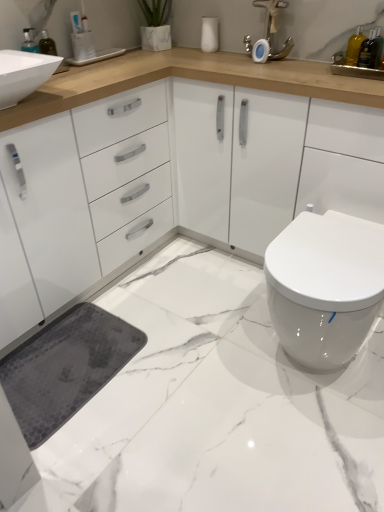
Question: Is blue plastic toothbrush at upper left, the first toiletry from the top, not inside matte silver faucet at upper center?

Choices:
 (A) yes
 (B) no

Answer: (A)

Question: Is blue plastic toothbrush at upper left, the 1th toiletry from the left, thinner than matte silver faucet at upper center?

Choices:
 (A) no
 (B) yes

Answer: (B)

Question: From the image's perspective, does blue plastic toothbrush at upper left, placed as the 1th toiletry when sorted from back to front, appear lower than matte silver faucet at upper center?

Choices:
 (A) yes
 (B) no

Answer: (A)

Question: From a real-world perspective, does blue plastic toothbrush at upper left, positioned as the 2th toiletry in bottom-to-top order, stand above matte silver faucet at upper center?

Choices:
 (A) no
 (B) yes

Answer: (B)

Question: Is blue plastic toothbrush at upper left, the 1th toiletry from the left, far from matte silver faucet at upper center?

Choices:
 (A) yes
 (B) no

Answer: (B)

Question: From the image's perspective, is blue plastic toothbrush at upper left, the first toiletry from the top, on top of matte silver faucet at upper center?

Choices:
 (A) no
 (B) yes

Answer: (A)

Question: From the image's perspective, is white glossy toilet at lower right below translucent glass bottle at upper right, the 2th sink from the left?

Choices:
 (A) yes
 (B) no

Answer: (A)

Question: Does white glossy toilet at lower right have a lesser height compared to translucent glass bottle at upper right, which is counted as the 1th sink, starting from the right?

Choices:
 (A) no
 (B) yes

Answer: (A)

Question: Considering the relative positions of white glossy toilet at lower right and translucent glass bottle at upper right, which is counted as the 1th sink, starting from the right, in the image provided, is white glossy toilet at lower right to the left of translucent glass bottle at upper right, which is counted as the 1th sink, starting from the right, from the viewer's perspective?

Choices:
 (A) no
 (B) yes

Answer: (B)

Question: From a real-world perspective, is white glossy toilet at lower right positioned under translucent glass bottle at upper right, which is counted as the 1th sink, starting from the right, based on gravity?

Choices:
 (A) no
 (B) yes

Answer: (B)

Question: Can you confirm if white glossy toilet at lower right is wider than translucent glass bottle at upper right, the 2th sink from the left?

Choices:
 (A) no
 (B) yes

Answer: (B)

Question: Is white glossy toilet at lower right positioned beyond the bounds of translucent glass bottle at upper right, which is counted as the 1th sink, starting from the right?

Choices:
 (A) no
 (B) yes

Answer: (B)

Question: Would you consider translucent glass bottle at upper right, the first toiletry in the front-to-back sequence, to be distant from white glossy toilet at lower right?

Choices:
 (A) no
 (B) yes

Answer: (A)